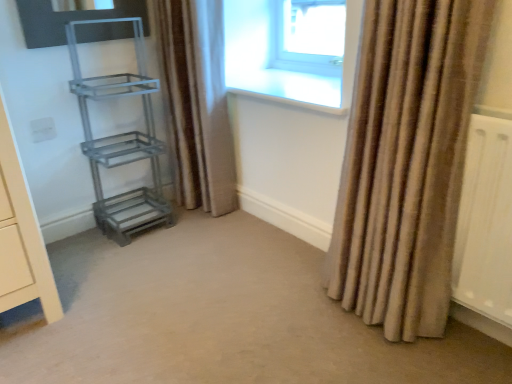
Question: Is metallic gray shelf at lower left, the first shelf positioned from the bottom, closer to camera compared to metallic gray shelf at left, which is counted as the 2th shelf, starting from the bottom?

Choices:
 (A) yes
 (B) no

Answer: (B)

Question: Is metallic gray shelf at lower left, the first shelf positioned from the bottom, looking in the opposite direction of metallic gray shelf at left, which ranks as the 1th shelf in top-to-bottom order?

Choices:
 (A) yes
 (B) no

Answer: (A)

Question: Considering the relative sizes of metallic gray shelf at lower left, which ranks as the second shelf in top-to-bottom order, and metallic gray shelf at left, which ranks as the 1th shelf in top-to-bottom order, in the image provided, is metallic gray shelf at lower left, which ranks as the second shelf in top-to-bottom order, bigger than metallic gray shelf at left, which ranks as the 1th shelf in top-to-bottom order,?

Choices:
 (A) no
 (B) yes

Answer: (A)

Question: From the image's perspective, is metallic gray shelf at lower left, which ranks as the second shelf in top-to-bottom order, over metallic gray shelf at left, which is counted as the 2th shelf, starting from the bottom?

Choices:
 (A) no
 (B) yes

Answer: (A)

Question: Can you confirm if metallic gray shelf at lower left, which ranks as the second shelf in top-to-bottom order, is smaller than metallic gray shelf at left, which is counted as the 2th shelf, starting from the bottom?

Choices:
 (A) yes
 (B) no

Answer: (A)

Question: From the image's perspective, is beige textured curtain at right, which ranks as the first curtain in front-to-back order, above or below brown textured curtain at center, the 1th curtain viewed from the left?

Choices:
 (A) above
 (B) below

Answer: (B)

Question: Considering the positions of point coord(385,61) and point coord(212,175), is point coord(385,61) closer or farther from the camera than point coord(212,175)?

Choices:
 (A) farther
 (B) closer

Answer: (B)

Question: Based on their positions, is beige textured curtain at right, which ranks as the first curtain in front-to-back order, located to the left or right of brown textured curtain at center, the 2th curtain when ordered from right to left?

Choices:
 (A) right
 (B) left

Answer: (A)

Question: Based on their sizes in the image, would you say beige textured curtain at right, which ranks as the first curtain in front-to-back order, is bigger or smaller than brown textured curtain at center, acting as the first curtain starting from the back?

Choices:
 (A) big
 (B) small

Answer: (A)

Question: Is transparent glass window at upper center wider or thinner than metallic gray shelf at left, which ranks as the 1th shelf in top-to-bottom order?

Choices:
 (A) wide
 (B) thin

Answer: (B)

Question: Would you say transparent glass window at upper center is inside or outside metallic gray shelf at left, which ranks as the 1th shelf in top-to-bottom order?

Choices:
 (A) inside
 (B) outside

Answer: (B)

Question: Is point (306, 54) positioned closer to the camera than point (115, 195)?

Choices:
 (A) farther
 (B) closer

Answer: (A)

Question: Is transparent glass window at upper center taller or shorter than metallic gray shelf at left, which ranks as the 1th shelf in top-to-bottom order?

Choices:
 (A) tall
 (B) short

Answer: (B)

Question: From the image's perspective, is metallic gray shelf at left, which ranks as the 1th shelf in top-to-bottom order, above or below brown textured curtain at center, the 2th curtain when ordered from right to left?

Choices:
 (A) above
 (B) below

Answer: (B)

Question: From a real-world perspective, relative to brown textured curtain at center, acting as the first curtain starting from the back, is metallic gray shelf at left, which ranks as the 1th shelf in top-to-bottom order, vertically above or below?

Choices:
 (A) below
 (B) above

Answer: (A)